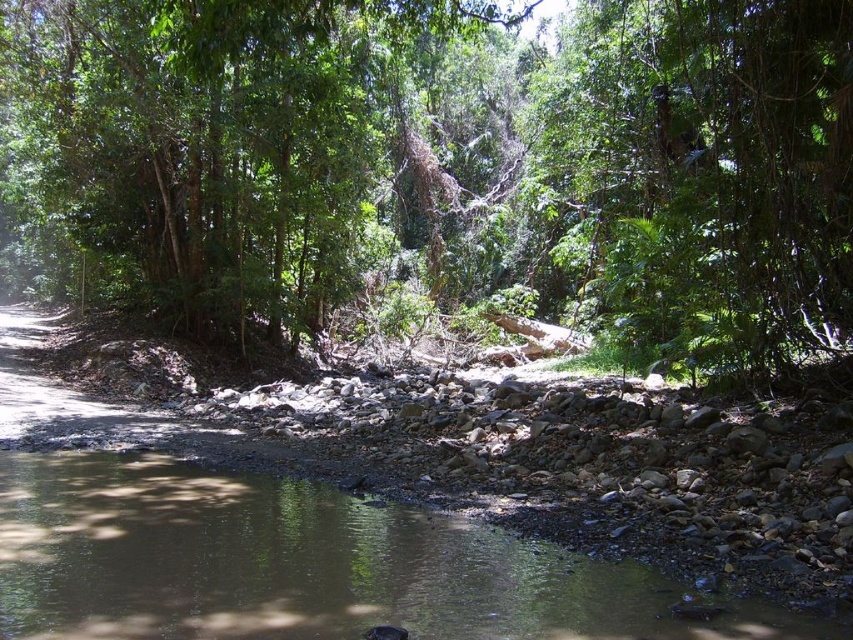
Where is `green leafy tree at center`? This screenshot has width=853, height=640. green leafy tree at center is located at coordinates (444, 157).

Who is more distant from viewer, [231,125] or [225,476]?

Positioned behind is point [231,125].

Find the location of a particular element. green leafy tree at center is located at coordinates (444, 157).